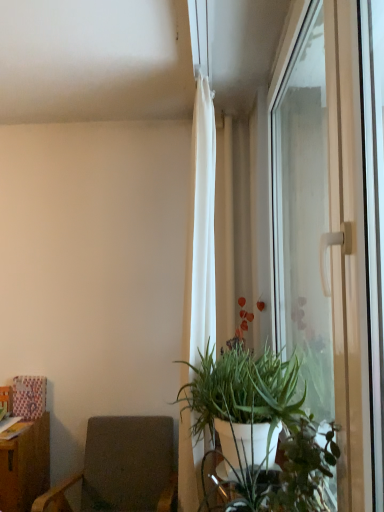
Question: Considering the relative sizes of dark gray fabric chair at lower left and white sheer curtain at upper center in the image provided, is dark gray fabric chair at lower left bigger than white sheer curtain at upper center?

Choices:
 (A) no
 (B) yes

Answer: (B)

Question: Is dark gray fabric chair at lower left to the left of white sheer curtain at upper center from the viewer's perspective?

Choices:
 (A) no
 (B) yes

Answer: (B)

Question: Is dark gray fabric chair at lower left next to white sheer curtain at upper center?

Choices:
 (A) no
 (B) yes

Answer: (A)

Question: Is dark gray fabric chair at lower left wider than white sheer curtain at upper center?

Choices:
 (A) no
 (B) yes

Answer: (B)

Question: Is dark gray fabric chair at lower left positioned beyond the bounds of white sheer curtain at upper center?

Choices:
 (A) yes
 (B) no

Answer: (A)

Question: Is transparent glass window at right in front of or behind green matte plant at center in the image?

Choices:
 (A) behind
 (B) front

Answer: (B)

Question: Is transparent glass window at right wider or thinner than green matte plant at center?

Choices:
 (A) wide
 (B) thin

Answer: (B)

Question: Considering the relative positions of transparent glass window at right and green matte plant at center in the image provided, is transparent glass window at right to the left or to the right of green matte plant at center?

Choices:
 (A) left
 (B) right

Answer: (B)

Question: Is transparent glass window at right situated inside green matte plant at center or outside?

Choices:
 (A) inside
 (B) outside

Answer: (B)

Question: Do you think green matte plant at center is within white matte plant pot at lower right, or outside of it?

Choices:
 (A) outside
 (B) inside

Answer: (A)

Question: Is green matte plant at center in front of or behind white matte plant pot at lower right in the image?

Choices:
 (A) front
 (B) behind

Answer: (B)

Question: Looking at the image, does green matte plant at center seem bigger or smaller compared to white matte plant pot at lower right?

Choices:
 (A) small
 (B) big

Answer: (B)

Question: Considering the positions of green matte plant at center and white matte plant pot at lower right in the image, is green matte plant at center taller or shorter than white matte plant pot at lower right?

Choices:
 (A) tall
 (B) short

Answer: (A)

Question: Considering the positions of dark gray fabric chair at lower left and white matte plant pot at lower right in the image, is dark gray fabric chair at lower left bigger or smaller than white matte plant pot at lower right?

Choices:
 (A) small
 (B) big

Answer: (B)

Question: Would you say dark gray fabric chair at lower left is inside or outside white matte plant pot at lower right?

Choices:
 (A) inside
 (B) outside

Answer: (B)